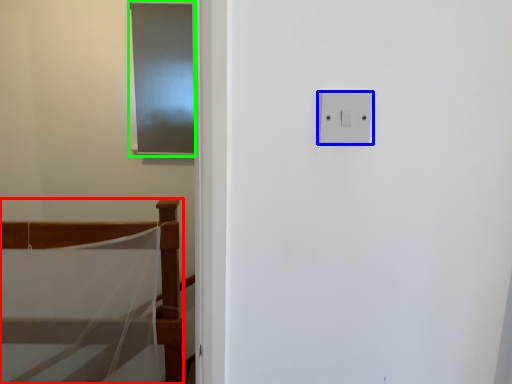
Question: Considering the real-world distances, which object is farthest from furniture (highlighted by a red box)? light switch (highlighted by a blue box) or screen door (highlighted by a green box)?

Choices:
 (A) light switch
 (B) screen door

Answer: (A)